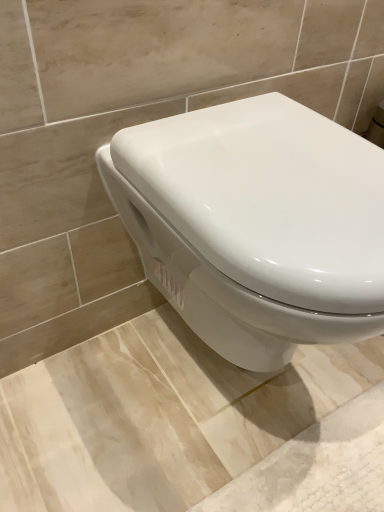
This screenshot has height=512, width=384. What do you see at coordinates (256, 224) in the screenshot?
I see `white glossy toilet at center` at bounding box center [256, 224].

Locate an element on the screen. The width and height of the screenshot is (384, 512). white glossy toilet at center is located at coordinates (256, 224).

You are a GUI agent. You are given a task and a screenshot of the screen. Output one action in this format:
    pyautogui.click(x=<x>, y=<y>)
    Task: Click on the white glossy toilet at center
    This screenshot has width=384, height=512.
    Given the screenshot: What is the action you would take?
    pyautogui.click(x=256, y=224)